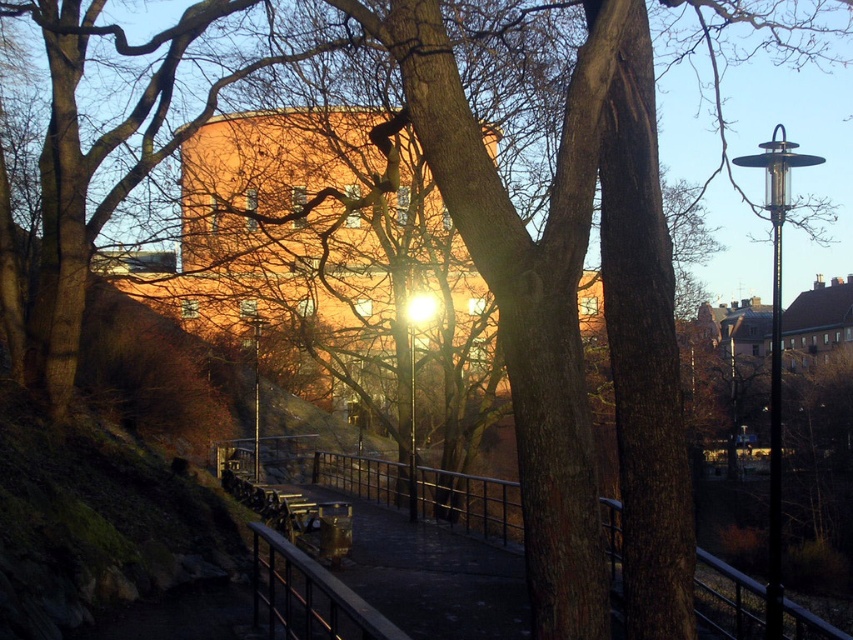
Can you confirm if black metal lamp post at right is smaller than metallic glass lamp post at center?

No, black metal lamp post at right is not smaller than metallic glass lamp post at center.

Can you confirm if black metal lamp post at right is bigger than metallic glass lamp post at center?

Yes, black metal lamp post at right is bigger than metallic glass lamp post at center.

Does point (775, 173) lie in front of point (410, 307)?

Yes.

Identify the location of black metal lamp post at right. Image resolution: width=853 pixels, height=640 pixels. (775, 346).

Locate an element on the screen. metallic gray rail at center is located at coordinates (471, 502).

Identify the location of metallic gray rail at center. pos(471,502).

Is metallic glass lamp post at center thinner than metallic pole at center?

Yes.

Between point (416, 298) and point (252, 308), which one is positioned in front?

Point (416, 298) is in front.

Is point (415, 316) positioned behind point (257, 376)?

No, it is in front of (257, 376).

Image resolution: width=853 pixels, height=640 pixels. What are the coordinates of `metallic glass lamp post at center` in the screenshot? It's located at (415, 388).